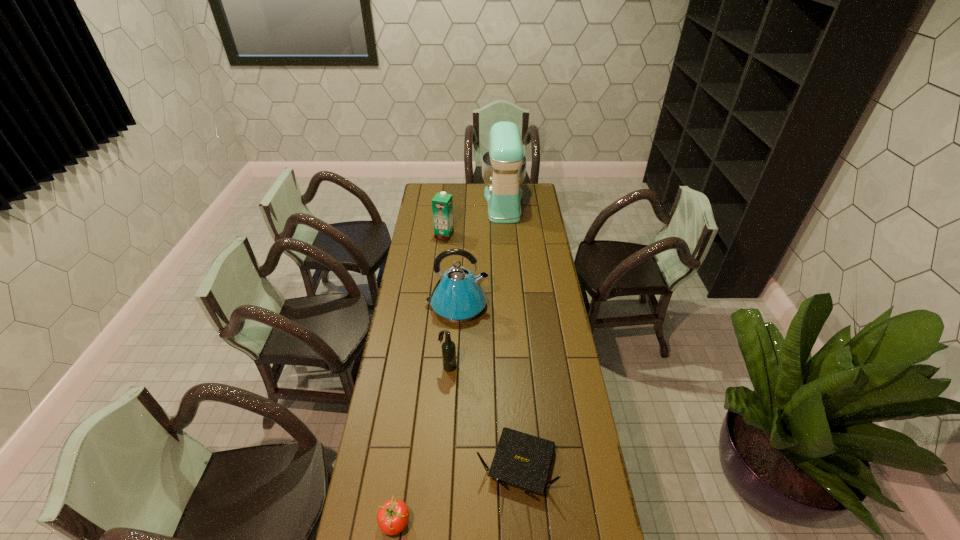
Locate an element on the screen. router that is positioned at the right edge is located at coordinates pyautogui.click(x=520, y=459).

Where is `object located at the far right corner`? object located at the far right corner is located at coordinates (504, 166).

In the image, there is a desktop. Where is `vacant space at the far edge`? The image size is (960, 540). vacant space at the far edge is located at coordinates (481, 201).

In the image, there is a desktop. At what (x,y) coordinates should I click in order to perform the action: click on free space at the left edge. Please return your answer as a coordinate pair (x, y). The height and width of the screenshot is (540, 960). Looking at the image, I should click on (395, 315).

This screenshot has height=540, width=960. Find the location of `free spot at the right edge of the desktop`. free spot at the right edge of the desktop is located at coordinates point(573,467).

Find the location of a particular element. The image size is (960, 540). vacant area between the farthest object and the third farthest object is located at coordinates (480, 254).

What are the coordinates of `free space that is in between the kettle and the router` in the screenshot? It's located at (487, 385).

Select which object is the second closest to the tallest object. Please provide its 2D coordinates. Your answer should be formatted as a tuple, i.e. [(x, y)], where the tuple contains the x and y coordinates of a point satisfying the conditions above.

[(458, 296)]

Locate an element on the screen. object that stands as the fourth closest to the shortest object is located at coordinates (442, 204).

Where is `vacant point that satisfies the following two spatial constraints: 1. at the spout of the router; 2. on the left side of the fourth nearest object`? vacant point that satisfies the following two spatial constraints: 1. at the spout of the router; 2. on the left side of the fourth nearest object is located at coordinates (448, 464).